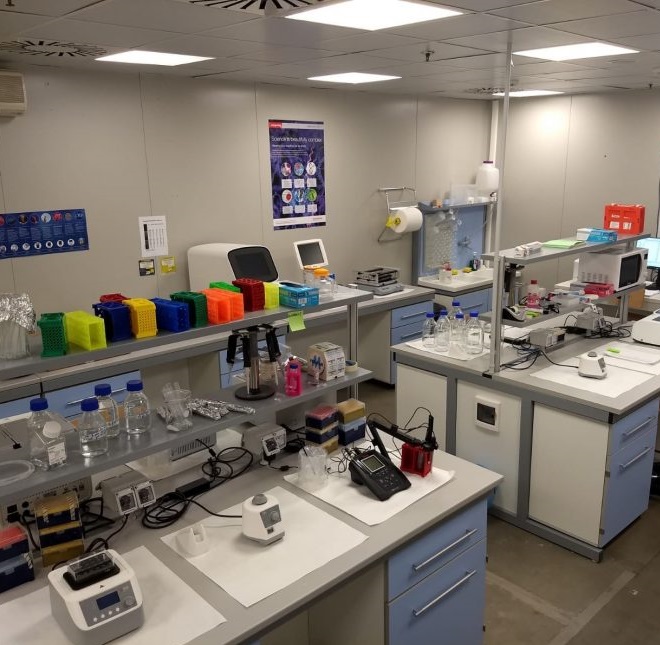
The image size is (660, 645). Identify the location of blue wall posters. (304, 162), (77, 235).